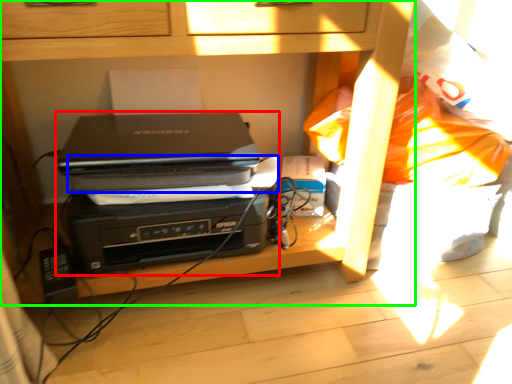
Question: Estimate the real-world distances between objects in this image. Which object is closer to printer (highlighted by a red box), paperback book (highlighted by a blue box) or furniture (highlighted by a green box)?

Choices:
 (A) paperback book
 (B) furniture

Answer: (A)